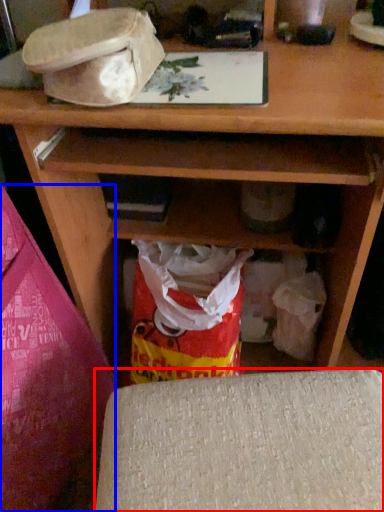
Question: Among these objects, which one is nearest to the camera, furniture (highlighted by a red box) or leftover (highlighted by a blue box)?

Choices:
 (A) furniture
 (B) leftover

Answer: (B)